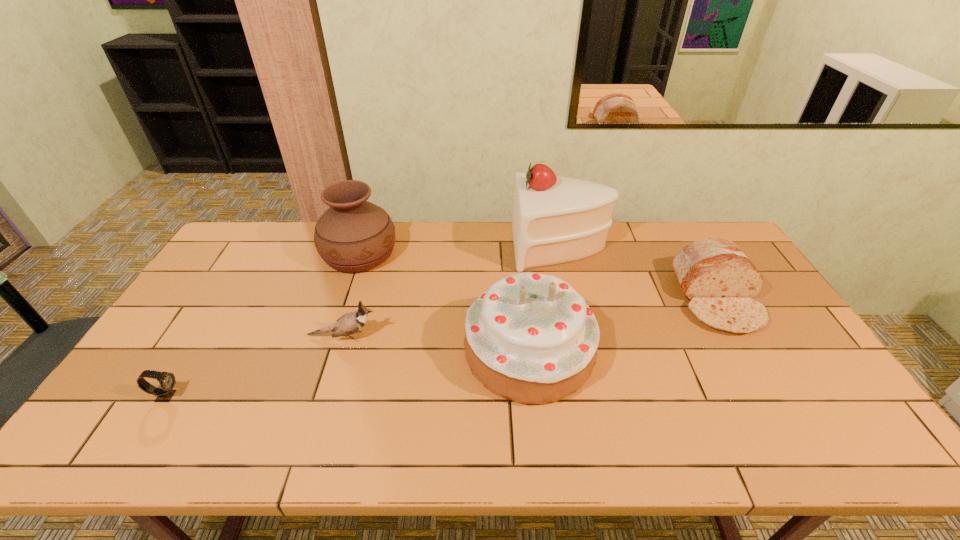
At what (x,y) coordinates should I click in order to perform the action: click on the farther cake. Please return your answer as a coordinate pair (x, y). The width and height of the screenshot is (960, 540). Looking at the image, I should click on (556, 219).

The height and width of the screenshot is (540, 960). I want to click on the tallest object, so click(x=556, y=219).

Locate an element on the screen. This screenshot has height=540, width=960. urn is located at coordinates 353,235.

Where is `the shorter cake`? Image resolution: width=960 pixels, height=540 pixels. the shorter cake is located at coordinates (530, 338).

Identify the location of the rightmost object. This screenshot has height=540, width=960. (717, 278).

Where is `bird`? bird is located at coordinates (352, 322).

Find the location of a particular element. watch is located at coordinates (167, 381).

The width and height of the screenshot is (960, 540). Find the location of `the shortest object`. the shortest object is located at coordinates (167, 381).

Identify the location of free location located 0.140m on the right of the taller cake. The image size is (960, 540). (646, 247).

This screenshot has height=540, width=960. What are the coordinates of `blank space located on the back of the urn` in the screenshot? It's located at coord(370,222).